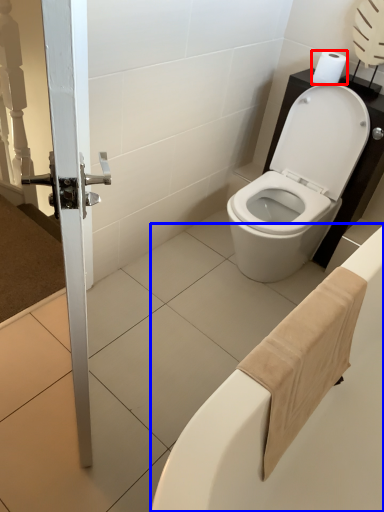
Question: Among these objects, which one is nearest to the camera, toilet paper (highlighted by a red box) or bath (highlighted by a blue box)?

Choices:
 (A) toilet paper
 (B) bath

Answer: (B)